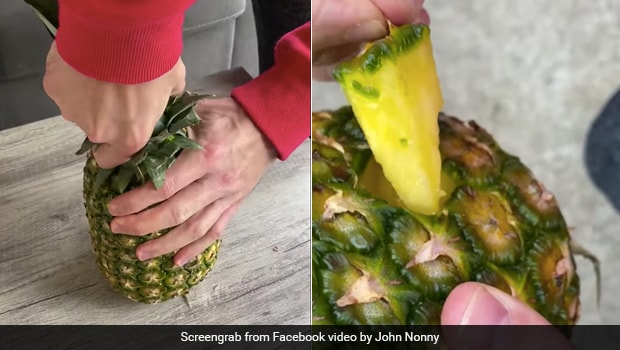
Where is `chair`? This screenshot has height=350, width=620. chair is located at coordinates (218, 17), (15, 62).